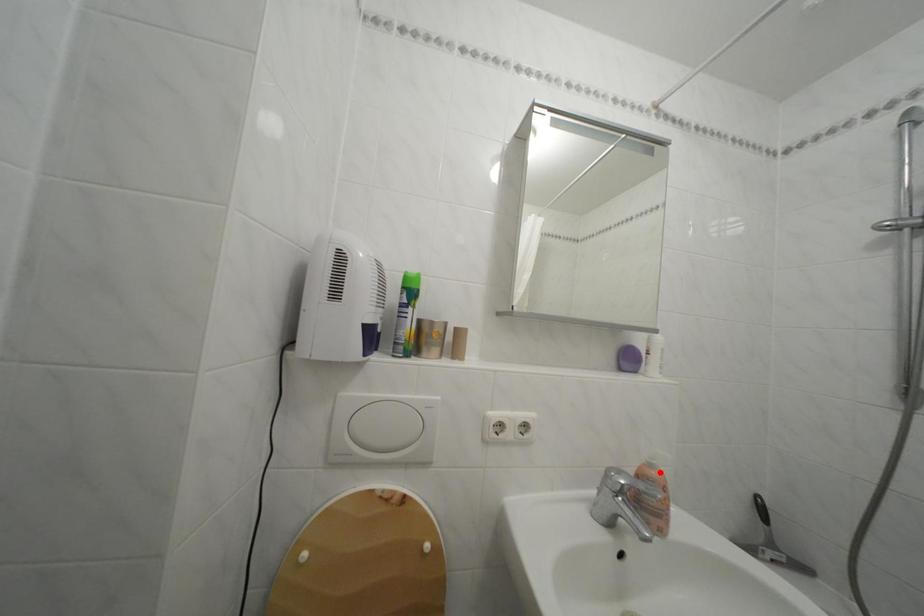
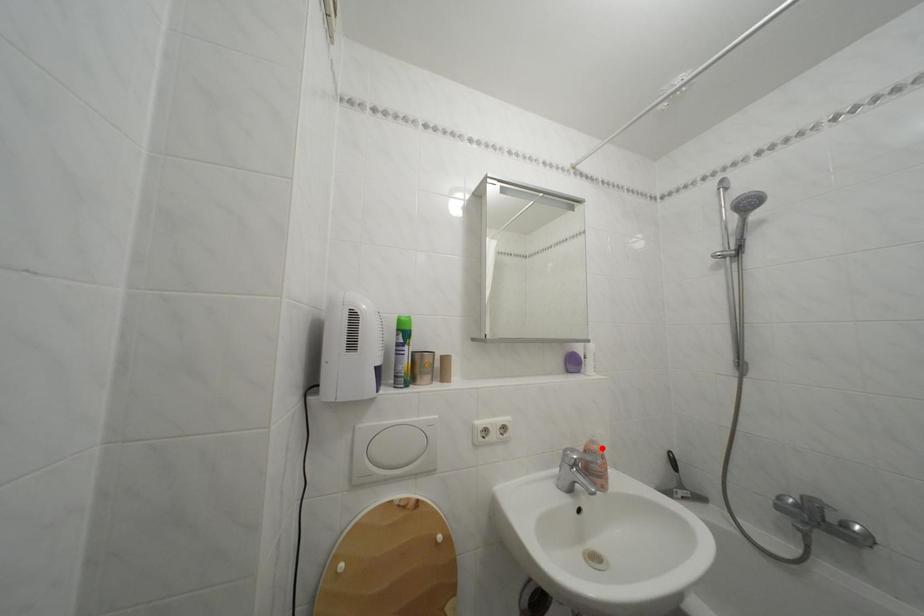
I am providing you with two images of the same scene from different viewpoints. A red point is marked on the first image and another point is marked on the second image. Is the red point in image1 aligned with the point shown in image2?

Yes